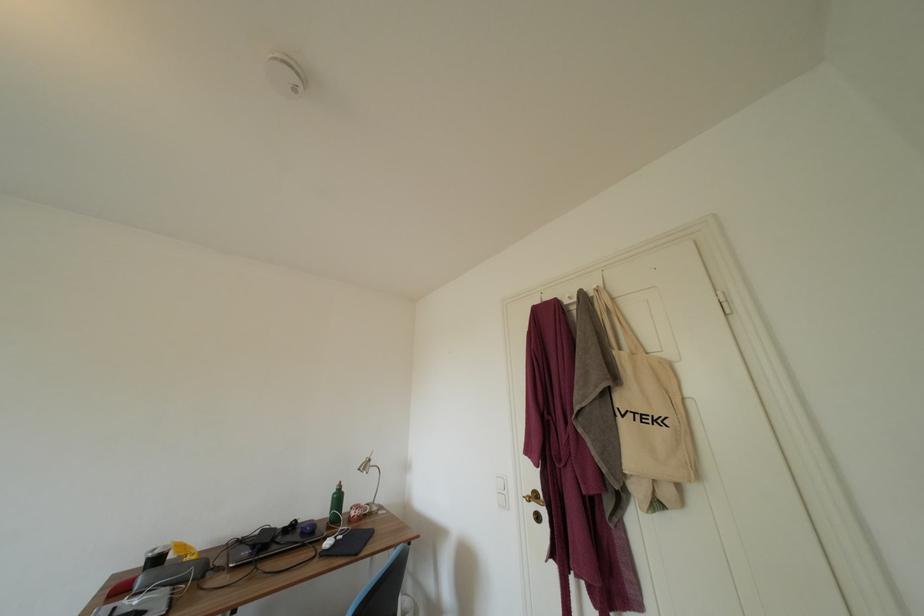
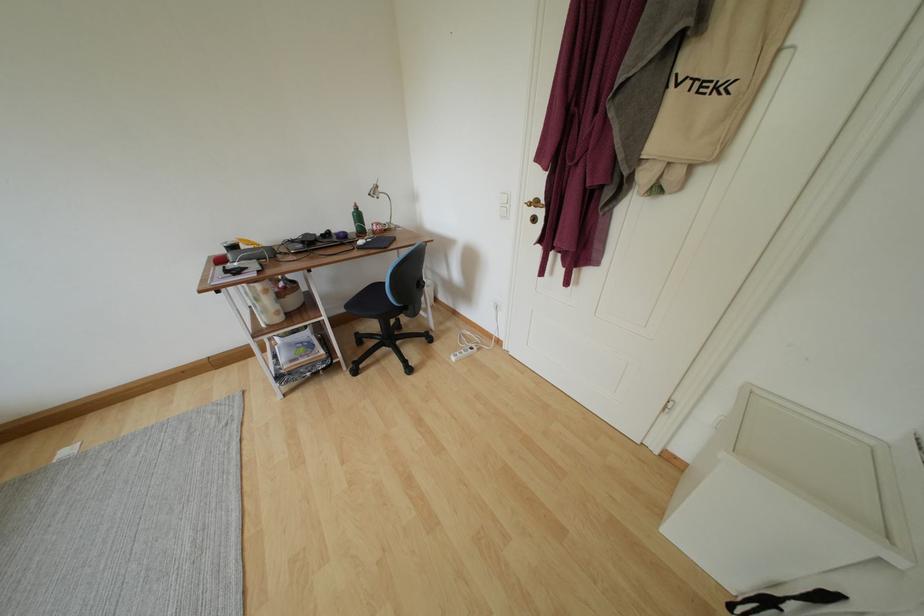
In the second image, find the point that corresponds to the point at 343,501 in the first image.

(363, 220)